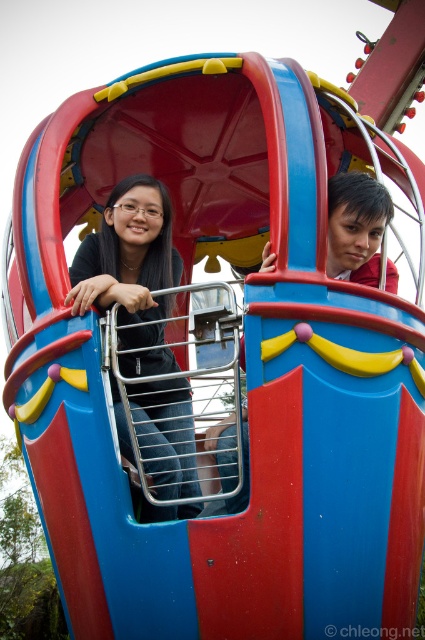
Can you confirm if matte black shirt at left is smaller than smooth red shirt at upper right?

No.

Which is in front, point (149, 432) or point (357, 244)?

Positioned in front is point (149, 432).

Identify the location of matte black shirt at left. This screenshot has height=640, width=425. (130, 252).